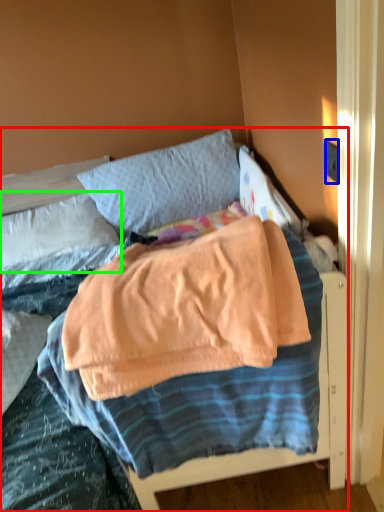
Question: Which object is positioned closest to bed (highlighted by a red box)? Select from electric outlet (highlighted by a blue box) and pillow (highlighted by a green box).

Choices:
 (A) electric outlet
 (B) pillow

Answer: (B)